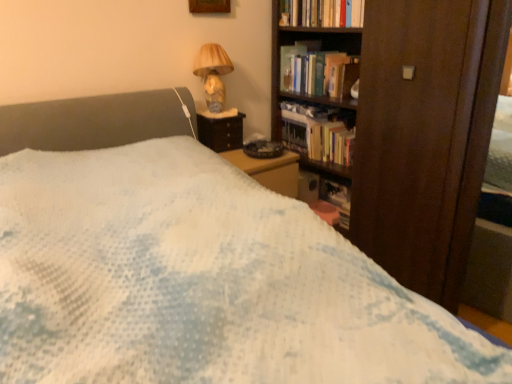
The image size is (512, 384). In order to click on free space above hardcover books at center, placed as the first book when sorted from bottom to top (from a real-world perspective) in this screenshot , I will do `click(326, 121)`.